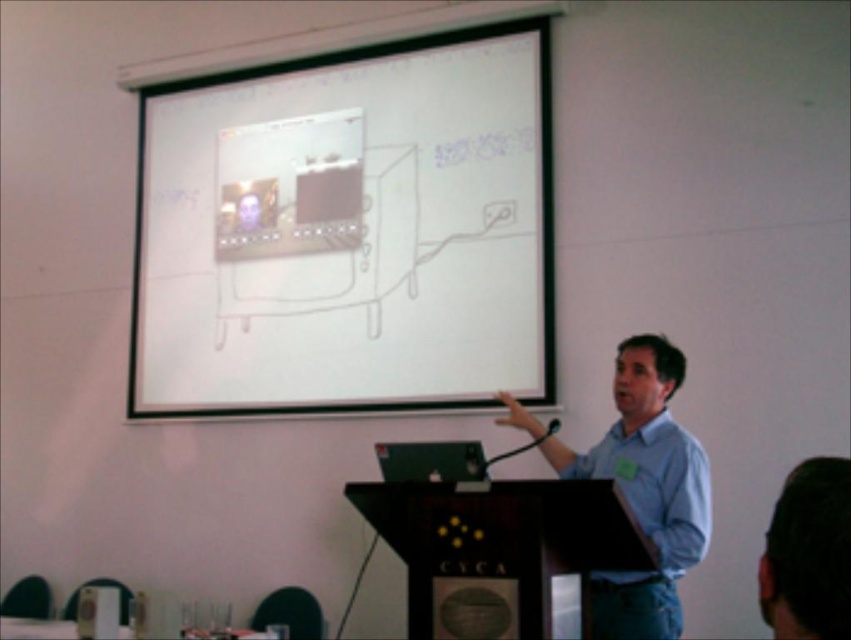
From the picture: Who is shorter, blue shirt at center or matte blue shirt at center?

Standing shorter between the two is matte blue shirt at center.

Measure the distance between blue shirt at center and camera.

blue shirt at center is 2.22 meters away from camera.

At what (x,y) coordinates should I click in order to perform the action: click on blue shirt at center. Please return your answer as a coordinate pair (x, y). Image resolution: width=851 pixels, height=640 pixels. Looking at the image, I should click on (640, 488).

Is white matte projection screen at upper center thinner than black wood podium at center?

In fact, white matte projection screen at upper center might be wider than black wood podium at center.

Who is higher up, white matte projection screen at upper center or black wood podium at center?

white matte projection screen at upper center is above.

Does point (370, 54) come closer to viewer compared to point (493, 545)?

No, (370, 54) is behind (493, 545).

Image resolution: width=851 pixels, height=640 pixels. I want to click on white matte projection screen at upper center, so click(347, 230).

Is point (552, 540) positioned before point (615, 480)?

Yes, point (552, 540) is in front of point (615, 480).

Which is in front, point (529, 506) or point (680, 566)?

Positioned in front is point (529, 506).

The image size is (851, 640). I want to click on black wood podium at center, so click(x=500, y=538).